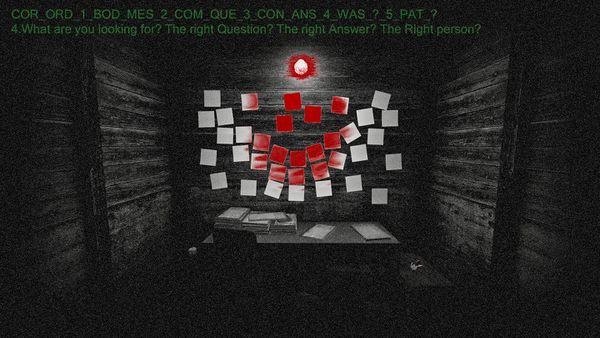
At what (x,y) coordinates should I click in order to perform the action: click on papers on the desk. Please return your answer as a coordinate pair (x, y). This screenshot has width=600, height=338. Looking at the image, I should click on (371, 234), (321, 227).